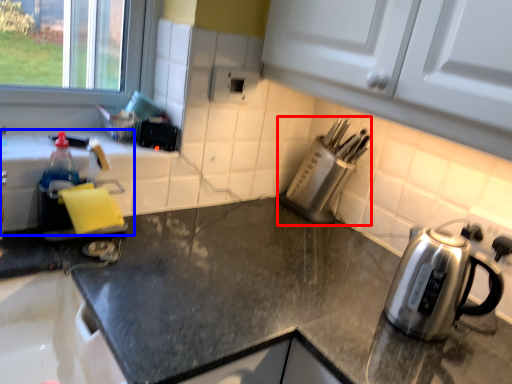
Question: Among these objects, which one is nearest to the camera, appliance (highlighted by a red box) or sink (highlighted by a blue box)?

Choices:
 (A) appliance
 (B) sink

Answer: (B)